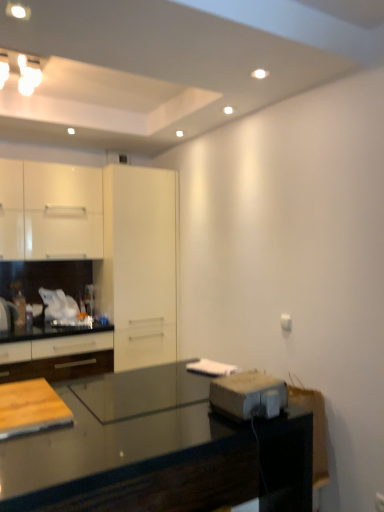
Locate an element on the screen. Image resolution: width=384 pixels, height=512 pixels. empty space that is ontop of metallic gray toaster at lower right (from a real-world perspective) is located at coordinates (251, 381).